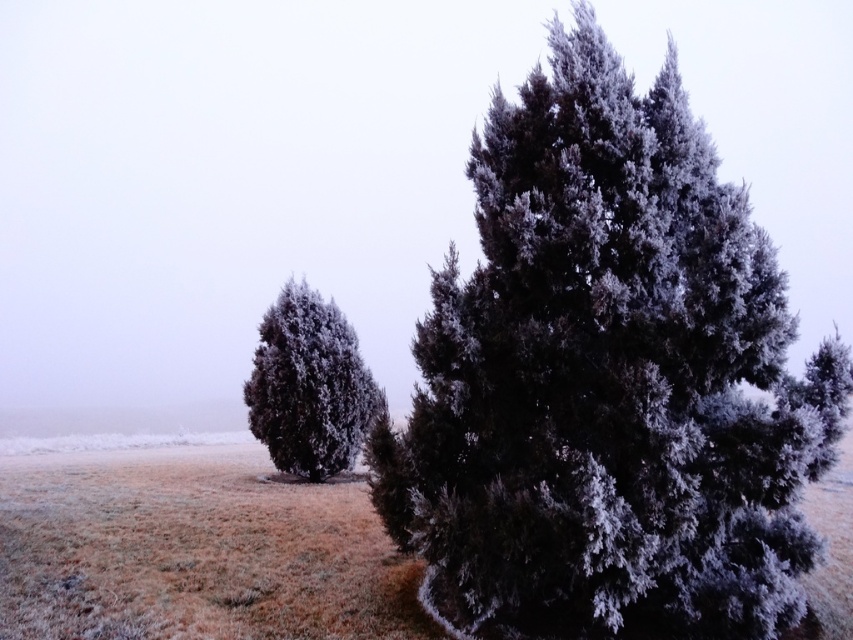
You are standing in a winter landscape and want to take a photo of the frosted dark green tree at center. If you are currently 4.03 meters away from it, is the tree in focus if your camera has a depth of field that starts at 3 meters and ends at 5 meters?

The frosted dark green tree at center is exactly 4.03 meters from the viewer. Since the camera depth of field starts at 3 meters and ends at 5 meters, the tree is within this range and will be in focus.

You are a gardener standing between the two frosted dark green trees. You need to place a decorative bench exactly halfway between them. Given that the distance between the frosted dark green tree at center and the frosted dark green tree at left is 4.98 meters, where should you position the bench?

The bench should be placed exactly halfway between the frosted dark green tree at center and the frosted dark green tree at left, which would be at 2.49 meters from each tree.